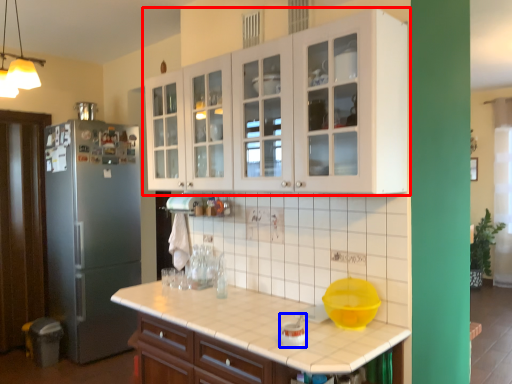
Question: Which of the following is the farthest to the observer, cabinetry (highlighted by a red box) or appliance (highlighted by a blue box)?

Choices:
 (A) cabinetry
 (B) appliance

Answer: (B)